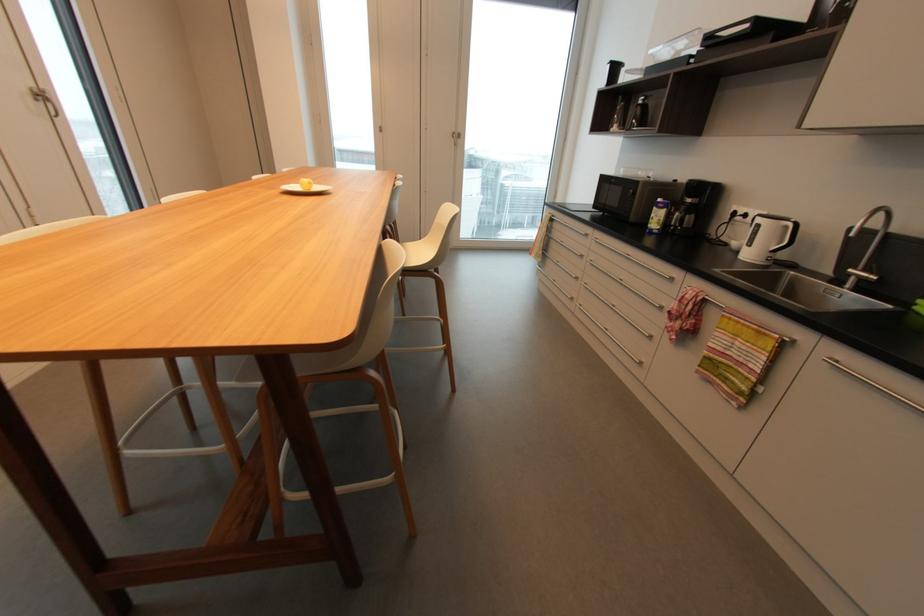
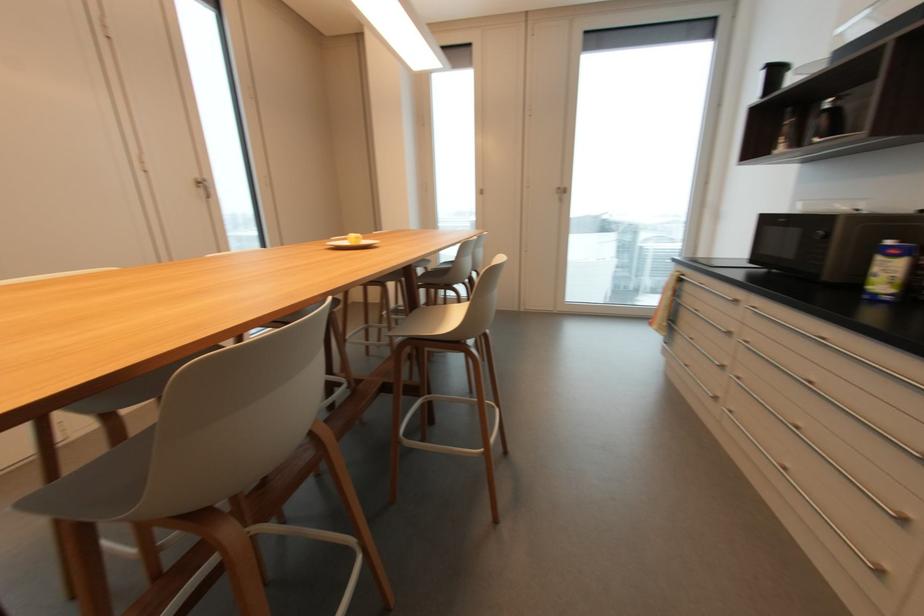
Question: The images are taken continuously from a first-person perspective. In which direction is your viewpoint rotating?

Choices:
 (A) Left
 (B) Right
 (C) Up
 (D) Down

Answer: (A)